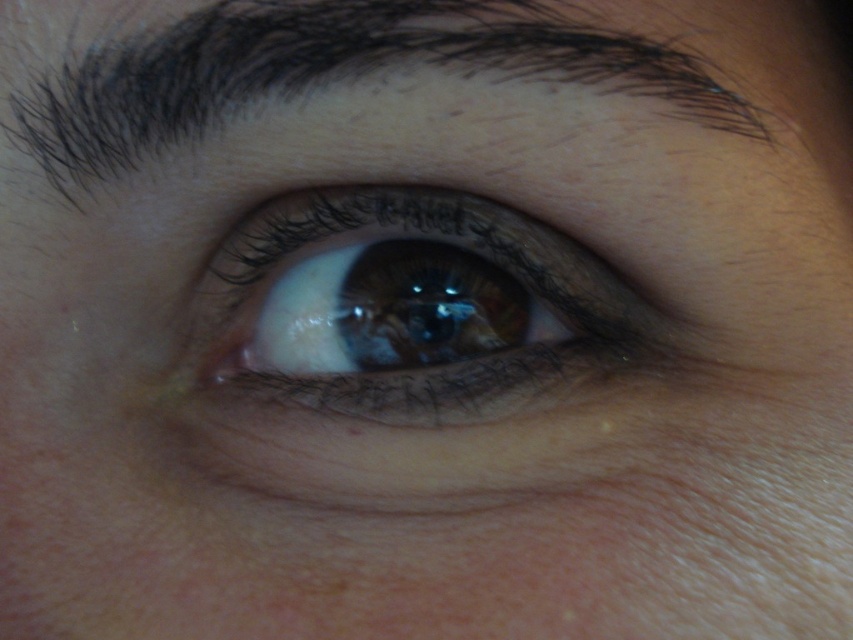
Question: Among these points, which one is farthest from the camera?

Choices:
 (A) (370, 310)
 (B) (392, 42)

Answer: (A)

Question: Is brown matte eye at center above dark brown hair at upper center?

Choices:
 (A) yes
 (B) no

Answer: (B)

Question: Which object appears farthest from the camera in this image?

Choices:
 (A) brown matte eye at center
 (B) dark brown hair at upper center

Answer: (A)

Question: Does brown matte eye at center have a greater width compared to dark brown hair at upper center?

Choices:
 (A) no
 (B) yes

Answer: (A)

Question: Is brown matte eye at center to the left of dark brown hair at upper center from the viewer's perspective?

Choices:
 (A) yes
 (B) no

Answer: (B)